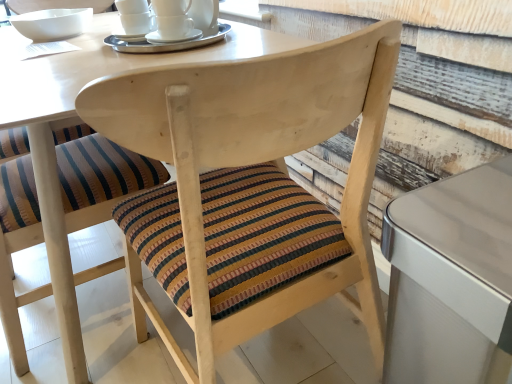
What are the coordinates of `white ceramic cups at upper center` in the screenshot? It's located at (165, 43).

What do you see at coordinates (100, 178) in the screenshot?
I see `striped fabric cushion at center, the first chair positioned from the left` at bounding box center [100, 178].

Locate an element on the screen. Image resolution: width=512 pixels, height=384 pixels. wooden chair at center, arranged as the first chair when viewed from the right is located at coordinates (255, 163).

Considering the relative sizes of white ceramic cups at upper center and striped fabric cushion at center, the second chair in the right-to-left sequence, in the image provided, is white ceramic cups at upper center wider than striped fabric cushion at center, the second chair in the right-to-left sequence,?

No.

Is white ceramic cups at upper center beside striped fabric cushion at center, the second chair in the right-to-left sequence?

white ceramic cups at upper center is not next to striped fabric cushion at center, the second chair in the right-to-left sequence, and they're not touching.

Does point (147, 50) come farther from viewer compared to point (19, 357)?

No, it is not.

From the image's perspective, which object appears higher, white ceramic cups at upper center or striped fabric cushion at center, the first chair positioned from the left?

white ceramic cups at upper center is shown above in the image.

Which is further, (443, 305) or (26, 21)?

Positioned behind is point (26, 21).

Is metallic silver table at right facing away from white ceramic bowl at upper left?

metallic silver table at right does not have its back to white ceramic bowl at upper left.

Does metallic silver table at right come behind white ceramic bowl at upper left?

No, it is in front of white ceramic bowl at upper left.

From a real-world perspective, is metallic silver table at right over white ceramic bowl at upper left?

No, from a real-world perspective, metallic silver table at right is not above white ceramic bowl at upper left.

Does metallic silver table at right have a greater height compared to white ceramic cups at upper center?

Yes, metallic silver table at right is taller than white ceramic cups at upper center.

From the image's perspective, which is below, metallic silver table at right or white ceramic cups at upper center?

metallic silver table at right, from the image's perspective.

Consider the image. Is metallic silver table at right wider than white ceramic cups at upper center?

Indeed, metallic silver table at right has a greater width compared to white ceramic cups at upper center.

Is white ceramic cups at upper center not close to wooden chair at center, which is the second chair from left to right?

That's not correct — white ceramic cups at upper center is a little close to wooden chair at center, which is the second chair from left to right.

Where is `the 1st chair directly beneath the white ceramic cups at upper center (from a real-world perspective)`? The image size is (512, 384). the 1st chair directly beneath the white ceramic cups at upper center (from a real-world perspective) is located at coordinates 255,163.

Is white ceramic cups at upper center taller or shorter than wooden chair at center, arranged as the first chair when viewed from the right?

In the image, white ceramic cups at upper center appears to be shorter than wooden chair at center, arranged as the first chair when viewed from the right.

Is white ceramic cups at upper center positioned with its back to wooden chair at center, which is the second chair from left to right?

That's not correct — white ceramic cups at upper center is not looking away from wooden chair at center, which is the second chair from left to right.

Is wooden chair at center, arranged as the first chair when viewed from the right, touching striped fabric cushion at center, the second chair in the right-to-left sequence?

No, wooden chair at center, arranged as the first chair when viewed from the right, is not beside striped fabric cushion at center, the second chair in the right-to-left sequence.

Considering the relative sizes of wooden chair at center, which is the second chair from left to right, and striped fabric cushion at center, the first chair positioned from the left, in the image provided, is wooden chair at center, which is the second chair from left to right, thinner than striped fabric cushion at center, the first chair positioned from the left,?

In fact, wooden chair at center, which is the second chair from left to right, might be wider than striped fabric cushion at center, the first chair positioned from the left.

Is wooden chair at center, which is the second chair from left to right, spatially inside striped fabric cushion at center, the first chair positioned from the left, or outside of it?

wooden chair at center, which is the second chair from left to right, cannot be found inside striped fabric cushion at center, the first chair positioned from the left.

From the image's perspective, which is below, wooden chair at center, which is the second chair from left to right, or striped fabric cushion at center, the second chair in the right-to-left sequence?

From the image's view, wooden chair at center, which is the second chair from left to right, is below.

From the image's perspective, starting from the white ceramic bowl at upper left, which chair is the 2nd one below? Please provide its 2D coordinates.

[(255, 163)]

Does wooden chair at center, which is the second chair from left to right, have a lesser height compared to white ceramic bowl at upper left?

No.

Considering the positions of objects wooden chair at center, which is the second chair from left to right, and white ceramic bowl at upper left in the image provided, who is more to the left, wooden chair at center, which is the second chair from left to right, or white ceramic bowl at upper left?

From the viewer's perspective, white ceramic bowl at upper left appears more on the left side.

Is wooden chair at center, which is the second chair from left to right, directly adjacent to white ceramic bowl at upper left?

No, wooden chair at center, which is the second chair from left to right, is not next to white ceramic bowl at upper left.

From the image's perspective, is metallic silver table at right under striped fabric cushion at center, the first chair positioned from the left?

Indeed, from the image's perspective, metallic silver table at right is shown beneath striped fabric cushion at center, the first chair positioned from the left.

Could you tell me if metallic silver table at right is facing striped fabric cushion at center, the first chair positioned from the left?

No, metallic silver table at right is not oriented towards striped fabric cushion at center, the first chair positioned from the left.

At what (x,y) coordinates should I click in order to perform the action: click on the 2nd chair to the left when counting from the metallic silver table at right. Please return your answer as a coordinate pair (x, y). Looking at the image, I should click on (100, 178).

Can you confirm if metallic silver table at right is shorter than striped fabric cushion at center, the second chair in the right-to-left sequence?

Yes, metallic silver table at right is shorter than striped fabric cushion at center, the second chair in the right-to-left sequence.

In order to click on tableware above the striped fabric cushion at center, the second chair in the right-to-left sequence (from a real-world perspective) in this screenshot , I will do `click(165, 43)`.

This screenshot has height=384, width=512. Find the location of `table below the white ceramic bowl at upper left (from the image's perspective)`. table below the white ceramic bowl at upper left (from the image's perspective) is located at coordinates (451, 279).

Estimate the real-world distances between objects in this image. Which object is further from white ceramic bowl at upper left, striped fabric cushion at center, the first chair positioned from the left, or white ceramic cups at upper center?

The object further to white ceramic bowl at upper left is striped fabric cushion at center, the first chair positioned from the left.

Considering their positions, is white ceramic bowl at upper left positioned closer to wooden chair at center, arranged as the first chair when viewed from the right, than metallic silver table at right?

metallic silver table at right lies closer to wooden chair at center, arranged as the first chair when viewed from the right, than the other object.

From the image, which object appears to be farther from white ceramic bowl at upper left, metallic silver table at right or white ceramic cups at upper center?

Based on the image, metallic silver table at right appears to be further to white ceramic bowl at upper left.

Looking at the image, which one is located closer to striped fabric cushion at center, the first chair positioned from the left, white ceramic cups at upper center or metallic silver table at right?

white ceramic cups at upper center.

Considering their positions, is white ceramic bowl at upper left positioned closer to wooden chair at center, arranged as the first chair when viewed from the right, than white ceramic cups at upper center?

white ceramic cups at upper center lies closer to wooden chair at center, arranged as the first chair when viewed from the right, than the other object.

Considering their positions, is white ceramic cups at upper center positioned further to wooden chair at center, which is the second chair from left to right, than striped fabric cushion at center, the first chair positioned from the left?

white ceramic cups at upper center is further to wooden chair at center, which is the second chair from left to right.

From the image, which object appears to be farther from wooden chair at center, arranged as the first chair when viewed from the right, striped fabric cushion at center, the first chair positioned from the left, or metallic silver table at right?

Among the two, striped fabric cushion at center, the first chair positioned from the left, is located further to wooden chair at center, arranged as the first chair when viewed from the right.

Based on their spatial positions, is metallic silver table at right or wooden chair at center, which is the second chair from left to right, further from striped fabric cushion at center, the second chair in the right-to-left sequence?

Based on the image, metallic silver table at right appears to be further to striped fabric cushion at center, the second chair in the right-to-left sequence.

What are the coordinates of `tableware between wooden chair at center, arranged as the first chair when viewed from the right, and white ceramic bowl at upper left in the front-back direction` in the screenshot? It's located at (165, 43).

The height and width of the screenshot is (384, 512). I want to click on chair situated between striped fabric cushion at center, the second chair in the right-to-left sequence, and metallic silver table at right from left to right, so click(x=255, y=163).

This screenshot has height=384, width=512. Find the location of `tableware between white ceramic bowl at upper left and metallic silver table at right`. tableware between white ceramic bowl at upper left and metallic silver table at right is located at coordinates (165, 43).

Find the location of `tableware between striped fabric cushion at center, the second chair in the right-to-left sequence, and metallic silver table at right`. tableware between striped fabric cushion at center, the second chair in the right-to-left sequence, and metallic silver table at right is located at coordinates (165, 43).